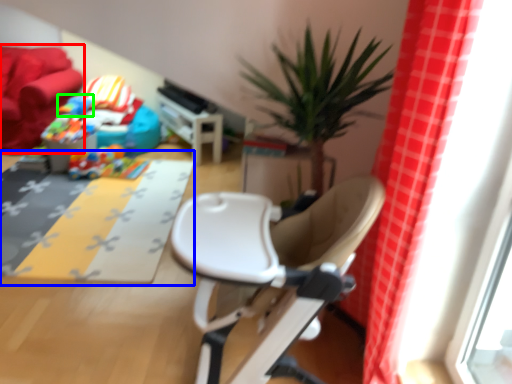
Question: Based on their relative distances, which object is nearer to couch (highlighted by a red box)? Choose from mat (highlighted by a blue box) and toy (highlighted by a green box).

Choices:
 (A) mat
 (B) toy

Answer: (B)